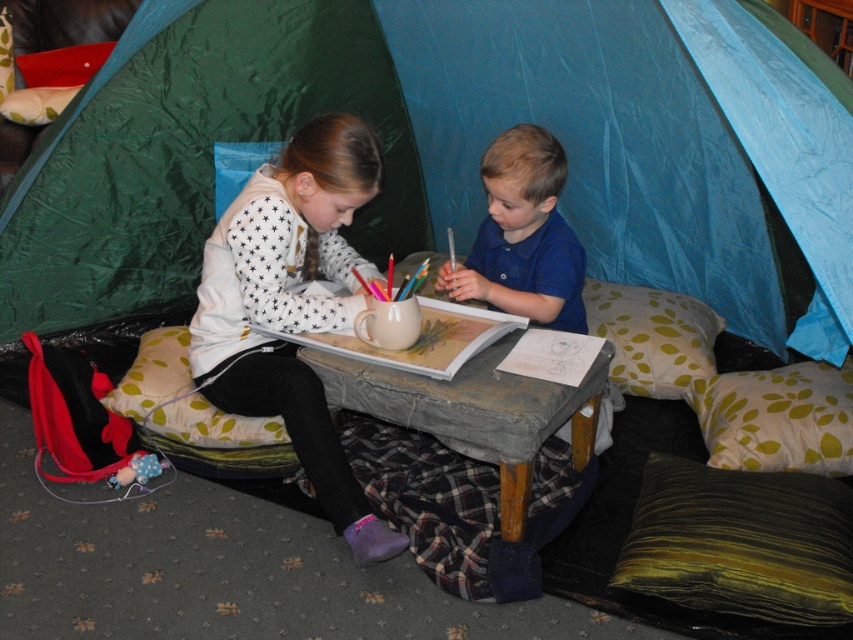
Who is more forward, (843, 604) or (749, 376)?

Point (843, 604) is more forward.

Between point (828, 609) and point (694, 404), which one is positioned behind?

The point (694, 404) is behind.

At what (x,y) coordinates should I click in order to perform the action: click on velvety green pillow at lower right. Please return your answer as a coordinate pair (x, y). The width and height of the screenshot is (853, 640). Looking at the image, I should click on (741, 541).

Is green fabric tent at center below fluffy beige pillow at lower left?

No.

You are a GUI agent. You are given a task and a screenshot of the screen. Output one action in this format:
    pyautogui.click(x=<x>, y=<y>)
    Task: Click on the green fabric tent at center
    This screenshot has height=640, width=853.
    Given the screenshot: What is the action you would take?
    pyautogui.click(x=450, y=147)

The width and height of the screenshot is (853, 640). Identify the location of green fabric tent at center. (450, 147).

The image size is (853, 640). Describe the element at coordinates (523, 236) in the screenshot. I see `blue cotton shirt at center` at that location.

Can you confirm if blue cotton shirt at center is positioned to the right of green leaf-patterned cushion at lower right?

Incorrect, blue cotton shirt at center is not on the right side of green leaf-patterned cushion at lower right.

At what (x,y) coordinates should I click in order to perform the action: click on blue cotton shirt at center. Please return your answer as a coordinate pair (x, y). The width and height of the screenshot is (853, 640). Looking at the image, I should click on (523, 236).

The image size is (853, 640). I want to click on blue cotton shirt at center, so click(x=523, y=236).